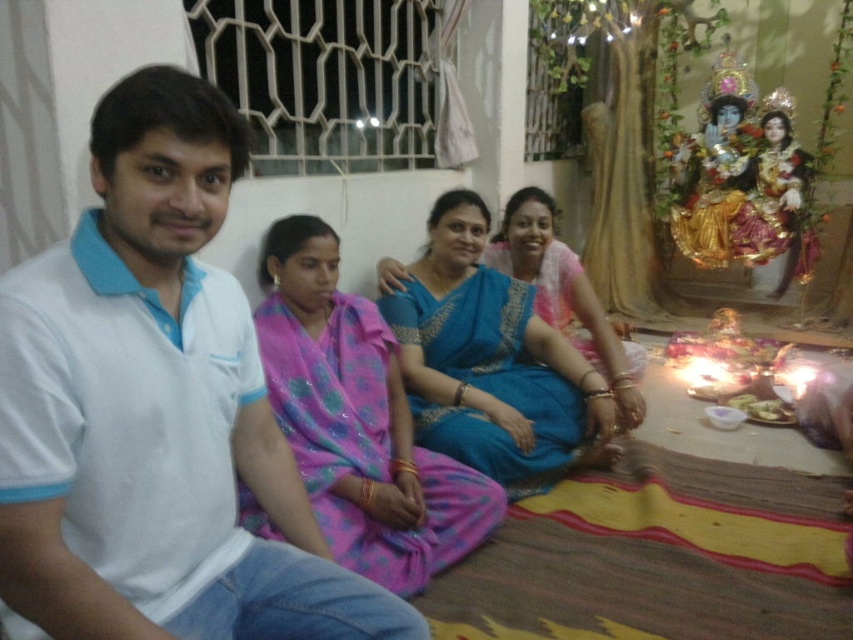
Question: Is white cotton shirt at left to the left of pink satin saree at center from the viewer's perspective?

Choices:
 (A) no
 (B) yes

Answer: (B)

Question: Which point is closer to the camera?

Choices:
 (A) pink satin saree at center
 (B) blue silk saree at center
 (C) white cotton shirt at left

Answer: (C)

Question: Which object is the farthest from the blue silk saree at center?

Choices:
 (A) pink satin saree at center
 (B) white cotton shirt at left

Answer: (B)

Question: Where is white cotton shirt at left located in relation to blue silk saree at center in the image?

Choices:
 (A) right
 (B) left

Answer: (B)

Question: Which is farther from the blue silk saree at center?

Choices:
 (A) pink satin saree at center
 (B) white cotton shirt at left

Answer: (B)

Question: Is pink satin saree at center thinner than blue silk saree at center?

Choices:
 (A) no
 (B) yes

Answer: (B)